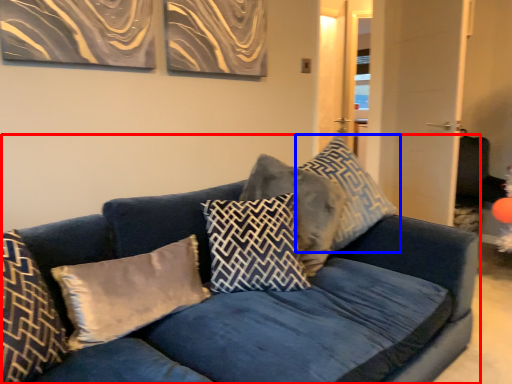
Question: Among these objects, which one is farthest to the camera, studio couch (highlighted by a red box) or pillow (highlighted by a blue box)?

Choices:
 (A) studio couch
 (B) pillow

Answer: (B)